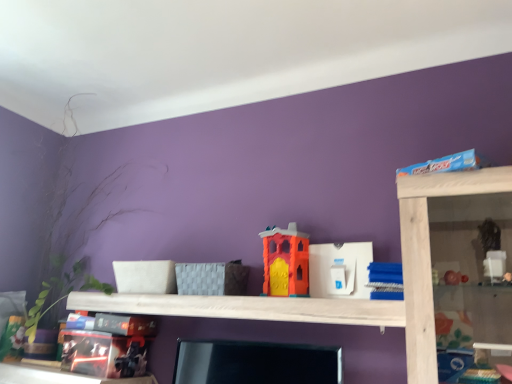
What do you see at coordinates (53, 222) in the screenshot? I see `green leafy plant at left` at bounding box center [53, 222].

How much space does blue plastic toy at upper right, arranged as the fourth toy when viewed from the left, occupy horizontally?

The width of blue plastic toy at upper right, arranged as the fourth toy when viewed from the left, is 7.14 inches.

This screenshot has height=384, width=512. What do you see at coordinates (340, 266) in the screenshot?
I see `white plastic toy at center, marked as the 2th toy in a right-to-left arrangement` at bounding box center [340, 266].

Describe the element at coordinates (285, 262) in the screenshot. I see `orange matte plastic toy at center, acting as the third toy starting from the right` at that location.

Describe the element at coordinates (109, 346) in the screenshot. I see `matt black toy at lower left, which is counted as the first toy, starting from the left` at that location.

Identify the location of green leafy plant at left. The width and height of the screenshot is (512, 384). (53, 222).

Is matt black toy at lower left, which is counted as the first toy, starting from the left, located within white plastic toy at center, marked as the 2th toy in a right-to-left arrangement?

That's incorrect, matt black toy at lower left, which is counted as the first toy, starting from the left, is not inside white plastic toy at center, marked as the 2th toy in a right-to-left arrangement.

How many degrees apart are the facing directions of white plastic toy at center, acting as the 3th toy starting from the left, and matt black toy at lower left, the fourth toy in the right-to-left sequence?

white plastic toy at center, acting as the 3th toy starting from the left, and matt black toy at lower left, the fourth toy in the right-to-left sequence, are facing 3.56 degrees away from each other.

Which is in front, point (339, 257) or point (110, 374)?

The point (339, 257) is closer to the camera.

From the image's perspective, which one is positioned higher, white plastic toy at center, marked as the 2th toy in a right-to-left arrangement, or matt black toy at lower left, the fourth toy in the right-to-left sequence?

white plastic toy at center, marked as the 2th toy in a right-to-left arrangement, from the image's perspective.

Does point (112, 312) lie in front of point (73, 201)?

That is True.

Considering the sizes of objects white wood shelf at center and green leafy plant at left in the image provided, who is smaller, white wood shelf at center or green leafy plant at left?

Smaller between the two is white wood shelf at center.

Is white wood shelf at center next to green leafy plant at left and touching it?

white wood shelf at center is not next to green leafy plant at left, and they're not touching.

Which is in front, green leafy plant at left or white wood shelf at center?

white wood shelf at center is closer to the camera.

From a real-world perspective, is green leafy plant at left over white wood shelf at center?

Yes, from a real-world perspective, green leafy plant at left is above white wood shelf at center.

How far apart are green leafy plant at left and white wood shelf at center?

green leafy plant at left is 27.51 inches from white wood shelf at center.

Can you tell me how much matt black toy at lower left, the fourth toy in the right-to-left sequence, and white wood shelf at center differ in facing direction?

The facing directions of matt black toy at lower left, the fourth toy in the right-to-left sequence, and white wood shelf at center are 2.62 degrees apart.

Is matt black toy at lower left, the fourth toy in the right-to-left sequence, thinner than white wood shelf at center?

No, matt black toy at lower left, the fourth toy in the right-to-left sequence, is not thinner than white wood shelf at center.

Based on their sizes in the image, would you say matt black toy at lower left, which is counted as the first toy, starting from the left, is bigger or smaller than white wood shelf at center?

Clearly, matt black toy at lower left, which is counted as the first toy, starting from the left, is larger in size than white wood shelf at center.

Where is `shelf above the matt black toy at lower left, the fourth toy in the right-to-left sequence (from the image's perspective)`? shelf above the matt black toy at lower left, the fourth toy in the right-to-left sequence (from the image's perspective) is located at coordinates (247, 308).

Between green leafy plant at left and orange matte plastic toy at center, marked as the 2th toy in a left-to-right arrangement, which one is positioned behind?

Positioned behind is green leafy plant at left.

Is green leafy plant at left outside of orange matte plastic toy at center, marked as the 2th toy in a left-to-right arrangement?

Absolutely, green leafy plant at left is external to orange matte plastic toy at center, marked as the 2th toy in a left-to-right arrangement.

Considering the sizes of objects green leafy plant at left and orange matte plastic toy at center, acting as the third toy starting from the right, in the image provided, who is smaller, green leafy plant at left or orange matte plastic toy at center, acting as the third toy starting from the right,?

Smaller between the two is orange matte plastic toy at center, acting as the third toy starting from the right.

From a real-world perspective, which is physically below, green leafy plant at left or orange matte plastic toy at center, marked as the 2th toy in a left-to-right arrangement?

In real-world perspective, orange matte plastic toy at center, marked as the 2th toy in a left-to-right arrangement, is lower.

Is point (282, 229) less distant than point (102, 368)?

No, it is not.

Is matt black toy at lower left, the fourth toy in the right-to-left sequence, inside orange matte plastic toy at center, acting as the third toy starting from the right?

No, matt black toy at lower left, the fourth toy in the right-to-left sequence, is located outside of orange matte plastic toy at center, acting as the third toy starting from the right.

From the image's perspective, is orange matte plastic toy at center, marked as the 2th toy in a left-to-right arrangement, above or below matt black toy at lower left, which is counted as the first toy, starting from the left?

Clearly, from the image's perspective, orange matte plastic toy at center, marked as the 2th toy in a left-to-right arrangement, is above matt black toy at lower left, which is counted as the first toy, starting from the left.

Between orange matte plastic toy at center, acting as the third toy starting from the right, and matt black toy at lower left, which is counted as the first toy, starting from the left, which one appears on the right side from the viewer's perspective?

orange matte plastic toy at center, acting as the third toy starting from the right, is more to the right.

Is white wood shelf at center positioned beyond the bounds of orange matte plastic toy at center, acting as the third toy starting from the right?

Yes, white wood shelf at center is located beyond the bounds of orange matte plastic toy at center, acting as the third toy starting from the right.

Consider the image. From a real-world perspective, is white wood shelf at center positioned above or below orange matte plastic toy at center, marked as the 2th toy in a left-to-right arrangement?

Clearly, from a real-world perspective, white wood shelf at center is below orange matte plastic toy at center, marked as the 2th toy in a left-to-right arrangement.

Does white wood shelf at center have a greater width compared to orange matte plastic toy at center, marked as the 2th toy in a left-to-right arrangement?

Yes.

Considering the relative positions of white wood shelf at center and orange matte plastic toy at center, marked as the 2th toy in a left-to-right arrangement, in the image provided, is white wood shelf at center behind orange matte plastic toy at center, marked as the 2th toy in a left-to-right arrangement,?

No, the depth of white wood shelf at center is less than that of orange matte plastic toy at center, marked as the 2th toy in a left-to-right arrangement.

Where is `toy that is the 2nd one above the matt black toy at lower left, the fourth toy in the right-to-left sequence (from a real-world perspective)`? This screenshot has width=512, height=384. toy that is the 2nd one above the matt black toy at lower left, the fourth toy in the right-to-left sequence (from a real-world perspective) is located at coordinates (340, 266).

At what (x,y) coordinates should I click in order to perform the action: click on shelf beneath the green leafy plant at left (from a real-world perspective). Please return your answer as a coordinate pair (x, y). Looking at the image, I should click on (247, 308).

Estimate the real-world distances between objects in this image. Which object is further from blue plastic toy at upper right, arranged as the fourth toy when viewed from the left, white plastic toy at center, acting as the 3th toy starting from the left, or green leafy plant at left?

green leafy plant at left is further to blue plastic toy at upper right, arranged as the fourth toy when viewed from the left.

Looking at the image, which one is located closer to white wood shelf at center, matt black toy at lower left, which is counted as the first toy, starting from the left, or orange matte plastic toy at center, marked as the 2th toy in a left-to-right arrangement?

orange matte plastic toy at center, marked as the 2th toy in a left-to-right arrangement, is closer to white wood shelf at center.

Estimate the real-world distances between objects in this image. Which object is further from blue plastic toy at upper right, arranged as the fourth toy when viewed from the left, matt black toy at lower left, the fourth toy in the right-to-left sequence, or white plastic toy at center, marked as the 2th toy in a right-to-left arrangement?

matt black toy at lower left, the fourth toy in the right-to-left sequence, lies further to blue plastic toy at upper right, arranged as the fourth toy when viewed from the left, than the other object.

Estimate the real-world distances between objects in this image. Which object is further from green leafy plant at left, white plastic toy at center, marked as the 2th toy in a right-to-left arrangement, or blue plastic toy at upper right, the 1th toy viewed from the right?

blue plastic toy at upper right, the 1th toy viewed from the right.

Looking at this image, considering their positions, is blue plastic toy at upper right, arranged as the fourth toy when viewed from the left, positioned further to orange matte plastic toy at center, marked as the 2th toy in a left-to-right arrangement, than white wood shelf at center?

blue plastic toy at upper right, arranged as the fourth toy when viewed from the left, lies further to orange matte plastic toy at center, marked as the 2th toy in a left-to-right arrangement, than the other object.

Estimate the real-world distances between objects in this image. Which object is further from matt black toy at lower left, which is counted as the first toy, starting from the left, orange matte plastic toy at center, marked as the 2th toy in a left-to-right arrangement, or green leafy plant at left?

The object further to matt black toy at lower left, which is counted as the first toy, starting from the left, is orange matte plastic toy at center, marked as the 2th toy in a left-to-right arrangement.

Looking at the image, which one is located further to orange matte plastic toy at center, acting as the third toy starting from the right, matt black toy at lower left, which is counted as the first toy, starting from the left, or green leafy plant at left?

Among the two, green leafy plant at left is located further to orange matte plastic toy at center, acting as the third toy starting from the right.

Looking at the image, which one is located closer to white plastic toy at center, acting as the 3th toy starting from the left, white wood shelf at center or matt black toy at lower left, the fourth toy in the right-to-left sequence?

white wood shelf at center is closer to white plastic toy at center, acting as the 3th toy starting from the left.

The image size is (512, 384). In order to click on shelf between matt black toy at lower left, the fourth toy in the right-to-left sequence, and blue plastic toy at upper right, the 1th toy viewed from the right in this screenshot , I will do `click(247, 308)`.

Where is `toy situated between green leafy plant at left and white wood shelf at center from left to right`? The width and height of the screenshot is (512, 384). toy situated between green leafy plant at left and white wood shelf at center from left to right is located at coordinates (109, 346).

Find the location of a particular element. This screenshot has width=512, height=384. toy located between white wood shelf at center and white plastic toy at center, acting as the 3th toy starting from the left, in the left-right direction is located at coordinates (285, 262).

The image size is (512, 384). I want to click on toy between green leafy plant at left and orange matte plastic toy at center, marked as the 2th toy in a left-to-right arrangement, so click(109, 346).